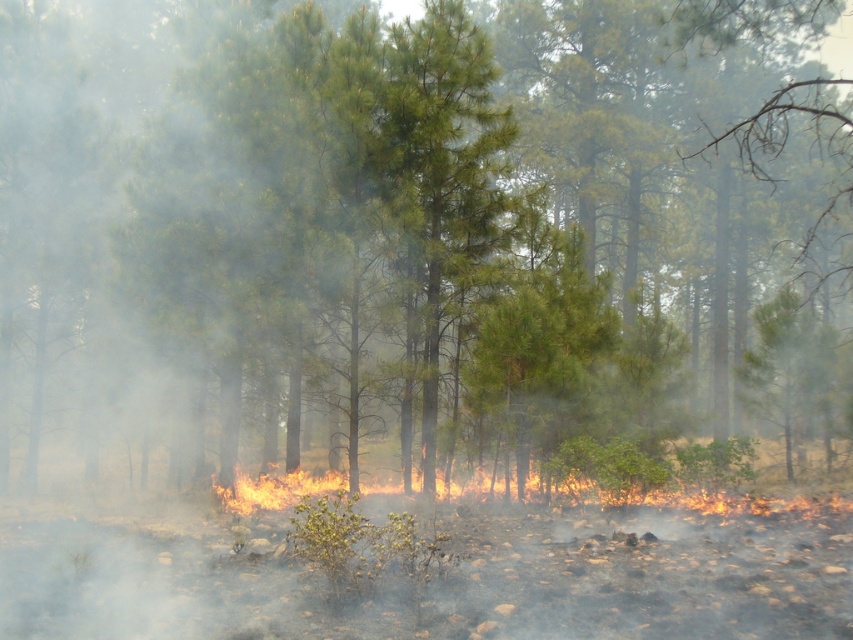
You are a firefighter assessing the fire situation. You need to reach a critical point at coordinates point (440, 48) to set up a firebreak. Your team can safely approach up to 20 meters from the fire. Can you safely reach the point without exceeding the safety distance?

The distance of point (440, 48) from camera is 16.90 meters, which is within the 20 meters safety limit. Therefore, you can safely reach the point to set up the firebreak.